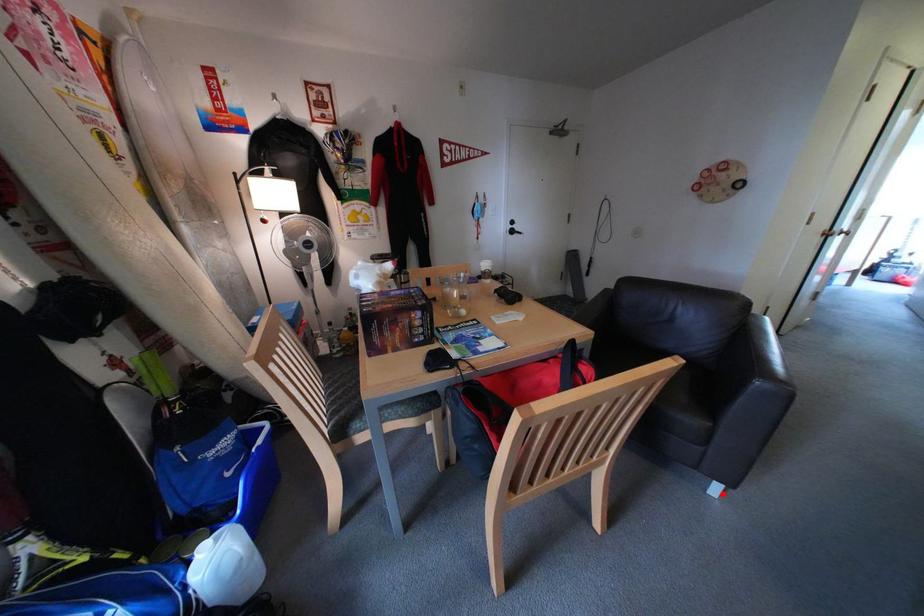
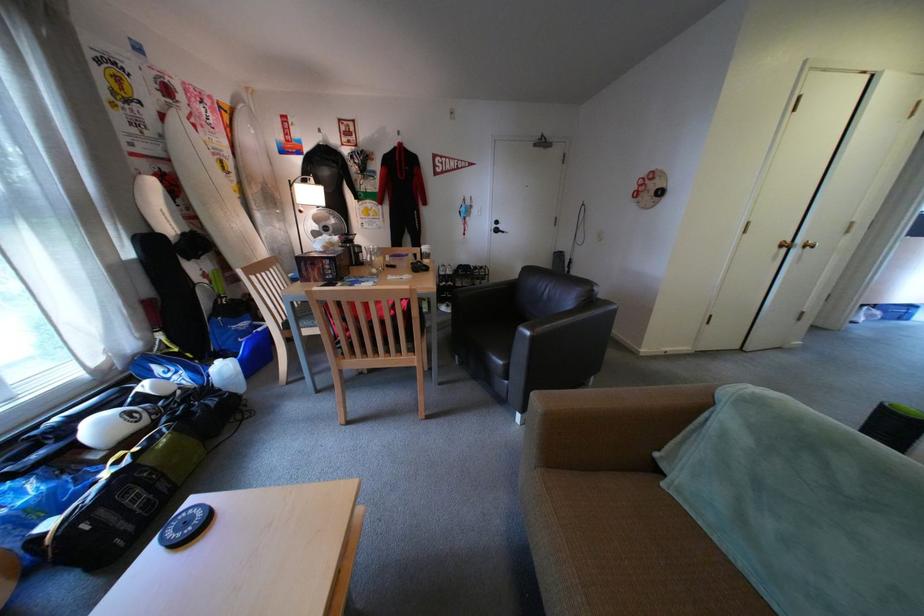
Question: I am providing you with two images of the same scene from different viewpoints. In image1, a red point is highlighted. Considering the same 3D point in image2, which of the following is correct?

Choices:
 (A) It is closer
 (B) It is farther

Answer: (B)